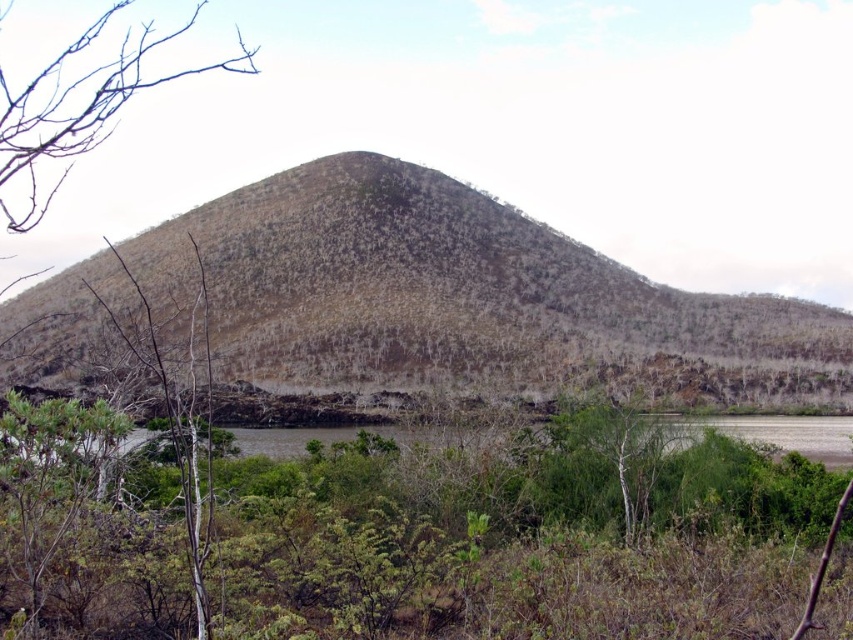
You are a hiker trying to navigate through the dense vegetation in the foreground. You see the brown bark tree at upper left and the green leafy tree at center. Which tree is higher up in the landscape?

The brown bark tree at upper left is higher up in the landscape than the green leafy tree at center because it is positioned above it.

You are a hiker trying to navigate through the dense vegetation in the foreground. You see a brown bark tree at upper left and a green leafy tree at center. Which tree would you encounter first if you walk straight ahead towards the center of the image?

The brown bark tree at upper left would be encountered first because it is positioned to the left of the green leafy tree at center, meaning it is closer to the starting point when moving towards the center.